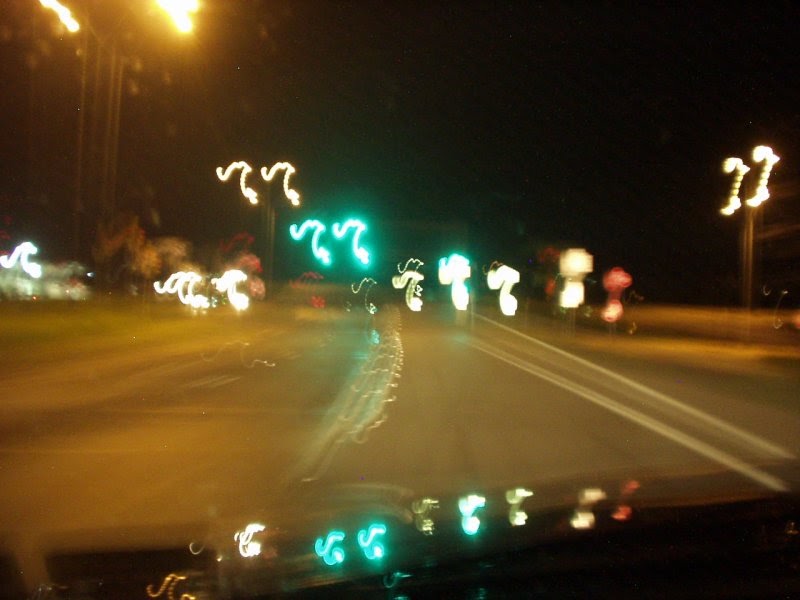
The image size is (800, 600). In order to click on light in this screenshot , I will do `click(360, 244)`.